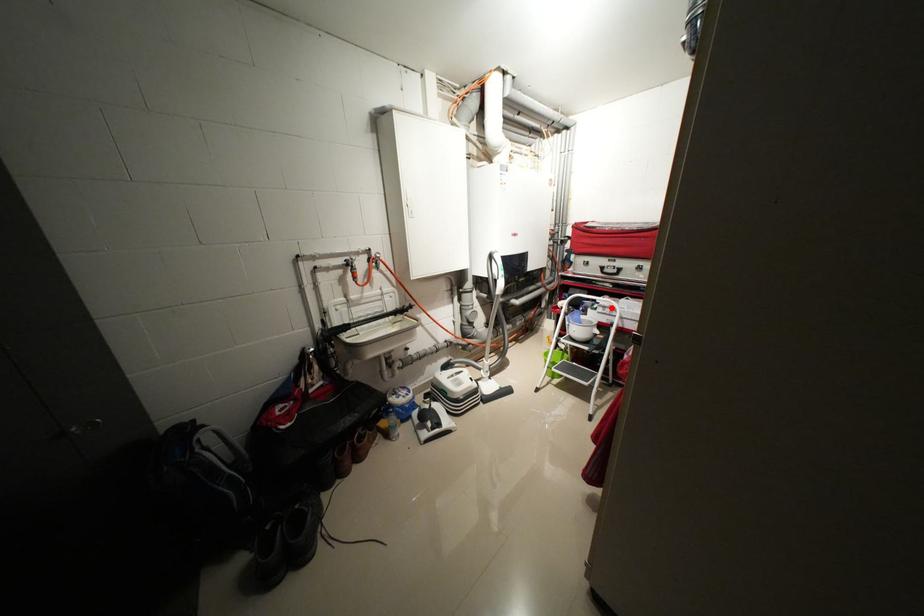
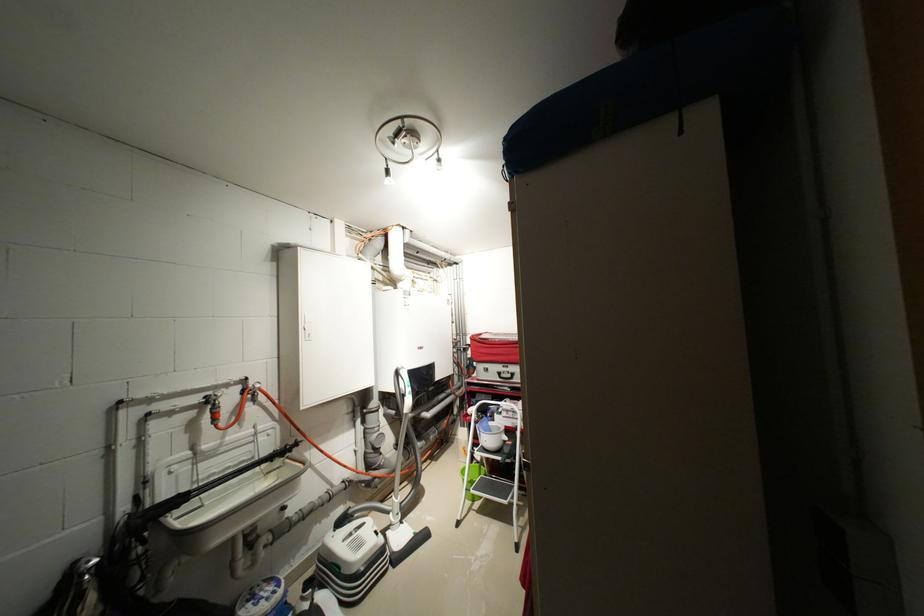
In the second image, find the point that corresponds to the highlighted location in the first image.

(515, 411)